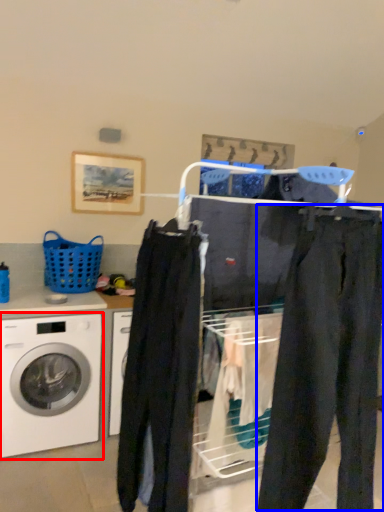
Question: Which object is closer to the camera taking this photo, washing machine (highlighted by a red box) or pants (highlighted by a blue box)?

Choices:
 (A) washing machine
 (B) pants

Answer: (B)